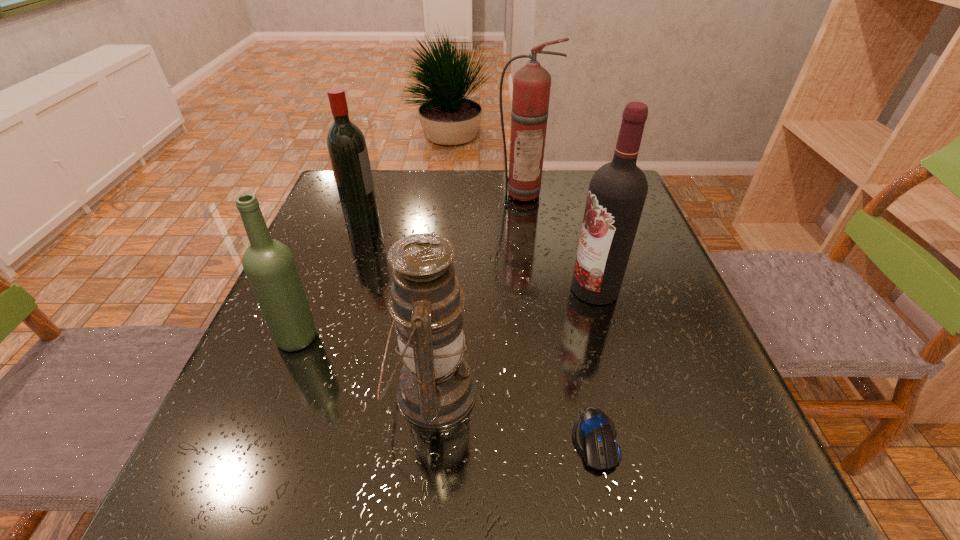
Locate an element on the screen. vacant point located between the computer mouse and the fifth nearest object is located at coordinates (478, 329).

The image size is (960, 540). I want to click on free spot between the farthest object and the fifth nearest object, so click(443, 206).

This screenshot has width=960, height=540. Identify the location of empty space between the fire extinguisher and the computer mouse. (559, 316).

Locate an element on the screen. Image resolution: width=960 pixels, height=540 pixels. object that stands as the second closest to the nearest wine bottle is located at coordinates (347, 148).

You are a GUI agent. You are given a task and a screenshot of the screen. Output one action in this format:
    pyautogui.click(x=<x>, y=<y>)
    Task: Click on the object that is the closest to the nearest wine bottle
    The width and height of the screenshot is (960, 540).
    Given the screenshot: What is the action you would take?
    pyautogui.click(x=436, y=389)

Locate an element on the screen. wine bottle object that ranks as the closest to the shortest object is located at coordinates (617, 192).

Find the location of a particular element. The image size is (960, 540). wine bottle that can be found as the closest to the second farthest object is located at coordinates (269, 265).

You are a GUI agent. You are given a task and a screenshot of the screen. Output one action in this format:
    pyautogui.click(x=<x>, y=<y>)
    Task: Click on the free space that satisfies the following two spatial constraints: 1. on the label of the rightmost wine bottle; 2. on the button side of the computer mouse
    Image resolution: width=960 pixels, height=540 pixels.
    Given the screenshot: What is the action you would take?
    pyautogui.click(x=637, y=440)

Locate an element on the screen. The height and width of the screenshot is (540, 960). vacant point that satisfies the following two spatial constraints: 1. on the label of the rightmost wine bottle; 2. on the front side of the oil lamp is located at coordinates (624, 392).

Find the location of a particular element. vacant point that satisfies the following two spatial constraints: 1. on the label of the fifth nearest object; 2. on the front side of the nearest wine bottle is located at coordinates (321, 337).